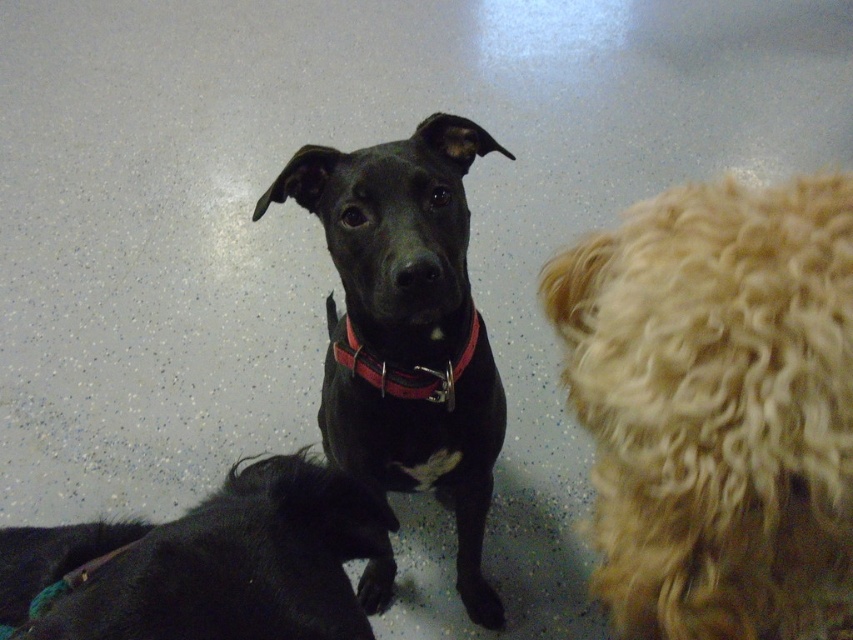
Question: Considering the real-world distances, which object is closest to the shiny black fur at lower left?

Choices:
 (A) black matte dog at center
 (B) red leather collar at center
 (C) curly blonde fur at right

Answer: (C)

Question: Estimate the real-world distances between objects in this image. Which object is closer to the shiny black fur at lower left?

Choices:
 (A) red leather collar at center
 (B) curly blonde fur at right

Answer: (B)

Question: Where is curly blonde fur at right located in relation to shiny black fur at lower left in the image?

Choices:
 (A) below
 (B) above

Answer: (B)

Question: Observing the image, what is the correct spatial positioning of curly blonde fur at right in reference to shiny black fur at lower left?

Choices:
 (A) above
 (B) below

Answer: (A)

Question: Which point is closer to the camera?

Choices:
 (A) black matte dog at center
 (B) red leather collar at center
 (C) shiny black fur at lower left

Answer: (C)

Question: Is curly blonde fur at right below shiny black fur at lower left?

Choices:
 (A) yes
 (B) no

Answer: (B)